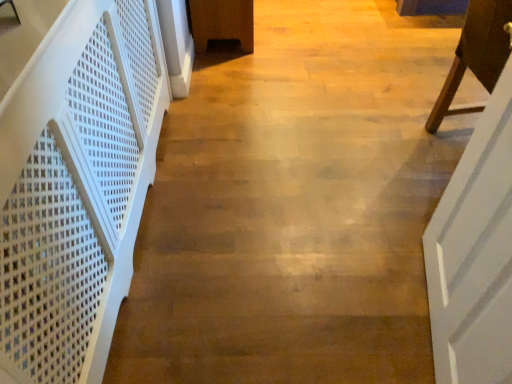
Locate an element on the screen. The image size is (512, 384). vacant space behind white wooden door at right is located at coordinates (374, 221).